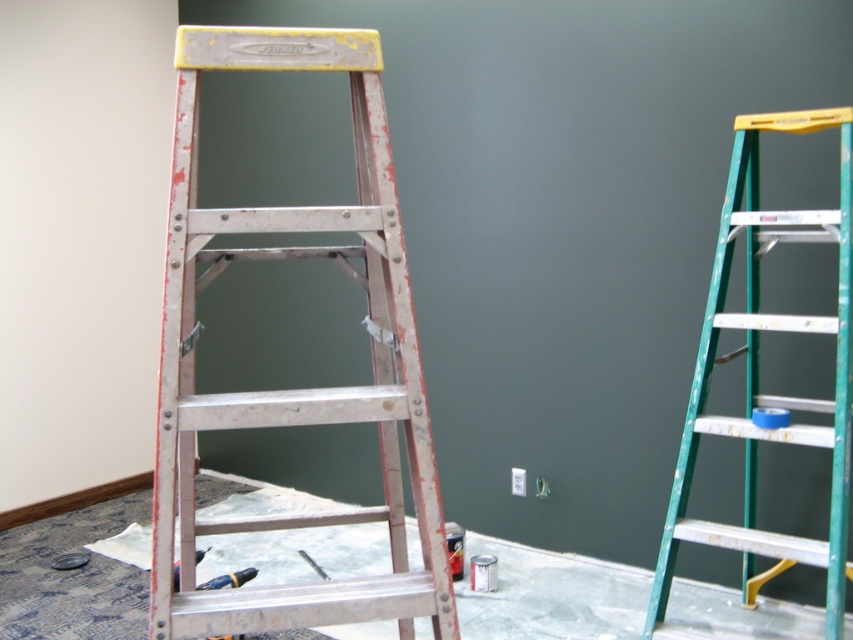
Between yellow plastic drill at lower left and metallic silver screwdriver at lower center, which one has more height?

yellow plastic drill at lower left

The image size is (853, 640). Describe the element at coordinates (229, 579) in the screenshot. I see `yellow plastic drill at lower left` at that location.

Which is behind, point (244, 572) or point (312, 560)?

The point (312, 560) is behind.

I want to click on yellow plastic drill at lower left, so click(229, 579).

Based on the photo, can you confirm if silver metallic ladder at center is positioned above green metallic ladder at right?

Indeed, silver metallic ladder at center is positioned over green metallic ladder at right.

Between point (263, 522) and point (821, 220), which one is positioned in front?

Point (263, 522) is in front.

Where is `silver metallic ladder at center`? silver metallic ladder at center is located at coordinates (294, 388).

Which of these two, silver metallic ladder at center or yellow plastic drill at lower left, stands shorter?

Standing shorter between the two is yellow plastic drill at lower left.

Can you confirm if silver metallic ladder at center is taller than yellow plastic drill at lower left?

Correct, silver metallic ladder at center is much taller as yellow plastic drill at lower left.

In the scene shown: Who is more distant from viewer, (x=438, y=506) or (x=248, y=570)?

The point (x=248, y=570) is behind.

You are a GUI agent. You are given a task and a screenshot of the screen. Output one action in this format:
    pyautogui.click(x=<x>, y=<y>)
    Task: Click on the silver metallic ladder at center
    
    Given the screenshot: What is the action you would take?
    pyautogui.click(x=294, y=388)